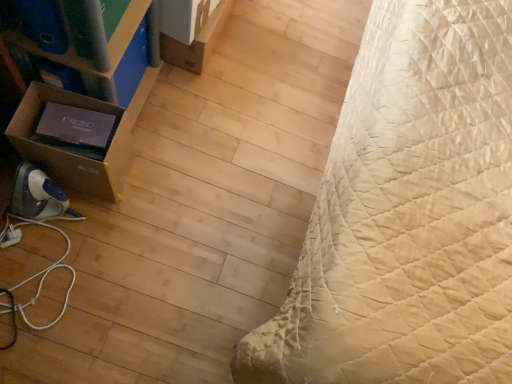
Question: Does beige quilted bed at right have a lesser width compared to matte cardboard box at left?

Choices:
 (A) yes
 (B) no

Answer: (B)

Question: Does beige quilted bed at right turn towards matte cardboard box at left?

Choices:
 (A) no
 (B) yes

Answer: (A)

Question: Is beige quilted bed at right located outside matte cardboard box at left?

Choices:
 (A) no
 (B) yes

Answer: (B)

Question: From the image's perspective, is beige quilted bed at right over matte cardboard box at left?

Choices:
 (A) no
 (B) yes

Answer: (A)

Question: Is beige quilted bed at right placed right next to matte cardboard box at left?

Choices:
 (A) yes
 (B) no

Answer: (B)

Question: From the image's perspective, is beige quilted bed at right positioned above or below brown cardboard box at left, placed as the 1th cardboard box when sorted from front to back?

Choices:
 (A) above
 (B) below

Answer: (A)

Question: Looking at the image, does beige quilted bed at right seem bigger or smaller compared to brown cardboard box at left, placed as the 1th cardboard box when sorted from front to back?

Choices:
 (A) small
 (B) big

Answer: (B)

Question: In the image, is beige quilted bed at right positioned in front of or behind brown cardboard box at left, arranged as the second cardboard box when viewed from the right?

Choices:
 (A) front
 (B) behind

Answer: (A)

Question: From a real-world perspective, relative to brown cardboard box at left, acting as the second cardboard box starting from the top, is beige quilted bed at right vertically above or below?

Choices:
 (A) above
 (B) below

Answer: (A)

Question: In terms of size, does brown cardboard box at left, which appears as the 1th cardboard box when viewed from the left, appear bigger or smaller than beige quilted bed at right?

Choices:
 (A) small
 (B) big

Answer: (A)

Question: From a real-world perspective, is brown cardboard box at left, which appears as the 1th cardboard box when viewed from the left, physically located above or below beige quilted bed at right?

Choices:
 (A) below
 (B) above

Answer: (A)

Question: From the image's perspective, is brown cardboard box at left, placed as the 1th cardboard box when sorted from front to back, above or below beige quilted bed at right?

Choices:
 (A) below
 (B) above

Answer: (A)

Question: Considering the positions of brown cardboard box at left, arranged as the second cardboard box when viewed from the right, and beige quilted bed at right in the image, is brown cardboard box at left, arranged as the second cardboard box when viewed from the right, taller or shorter than beige quilted bed at right?

Choices:
 (A) tall
 (B) short

Answer: (B)

Question: Is point (37, 109) positioned closer to the camera than point (195, 39)?

Choices:
 (A) closer
 (B) farther

Answer: (A)

Question: Based on their sizes in the image, would you say matte cardboard box at left is bigger or smaller than brown cardboard box at upper left, arranged as the first cardboard box when viewed from the top?

Choices:
 (A) small
 (B) big

Answer: (B)